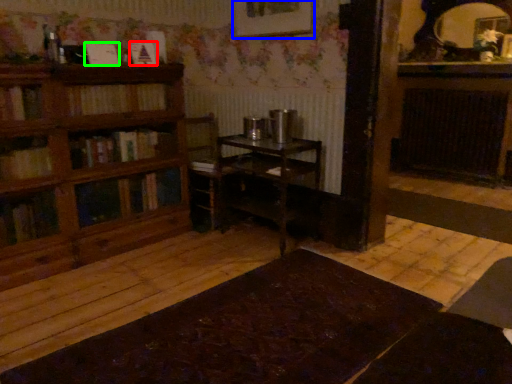
Question: Based on their relative distances, which object is nearer to book (highlighted by a red box)? Choose from picture frame (highlighted by a blue box) and book (highlighted by a green box).

Choices:
 (A) picture frame
 (B) book

Answer: (B)